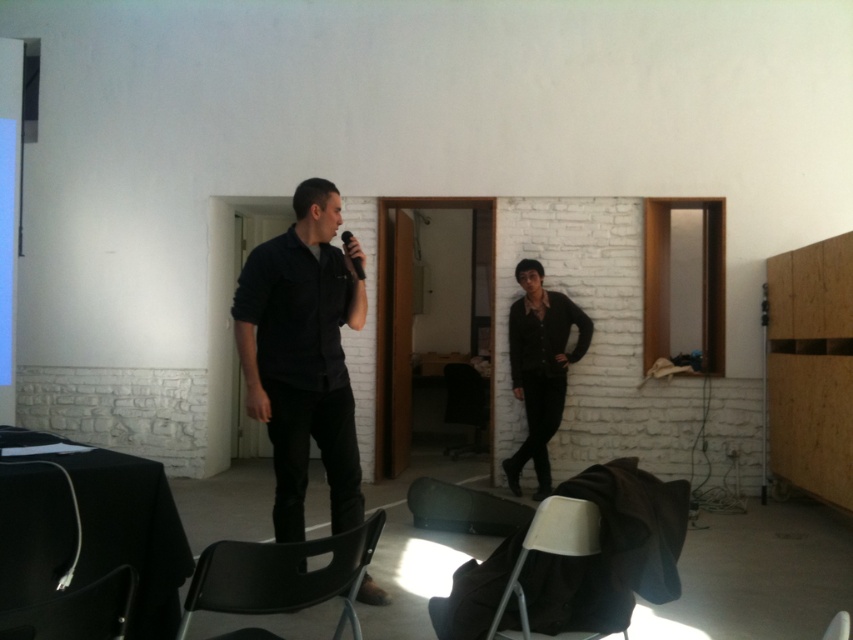
Question: From the image, what is the correct spatial relationship of black plastic chair at lower left in relation to matte black chair at lower center?

Choices:
 (A) right
 (B) left

Answer: (B)

Question: Is black plastic chair at lower center below matte black chair at center?

Choices:
 (A) yes
 (B) no

Answer: (B)

Question: Does matte black jacket at center appear on the right side of matte black chair at lower center?

Choices:
 (A) no
 (B) yes

Answer: (B)

Question: Which object is the closest to the black plastic chair at lower left?

Choices:
 (A) black plastic chair at lower center
 (B) matte black chair at center

Answer: (A)

Question: Which of the following is the closest to the observer?

Choices:
 (A) (253, 358)
 (B) (337, 561)
 (C) (444, 420)

Answer: (B)

Question: Which object is the closest to the black matte microphone at center?

Choices:
 (A) black plastic chair at lower center
 (B) matte black jacket at center
 (C) matte black chair at lower center
 (D) matte black shirt at center

Answer: (D)